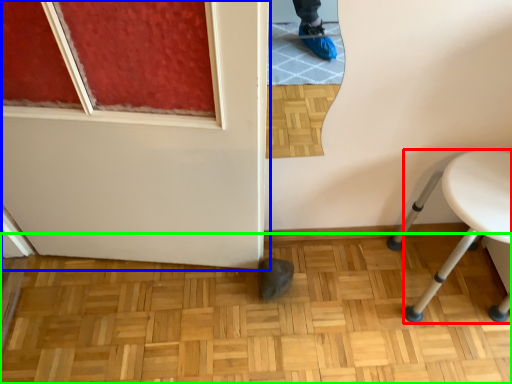
Question: Which is nearer to the furniture (highlighted by a red box)? door (highlighted by a blue box) or hardwood (highlighted by a green box).

Choices:
 (A) door
 (B) hardwood

Answer: (B)